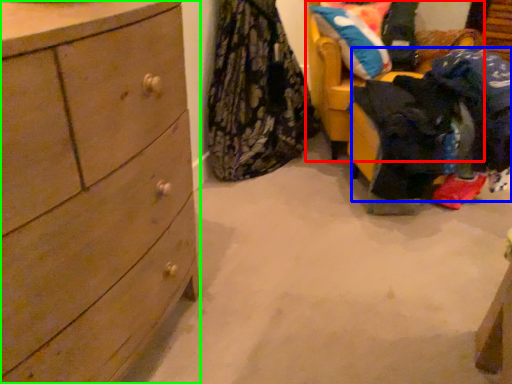
Question: Which object is positioned farthest from furniture (highlighted by a red box)? Select from clothing (highlighted by a blue box) and chest of drawers (highlighted by a green box).

Choices:
 (A) clothing
 (B) chest of drawers

Answer: (B)